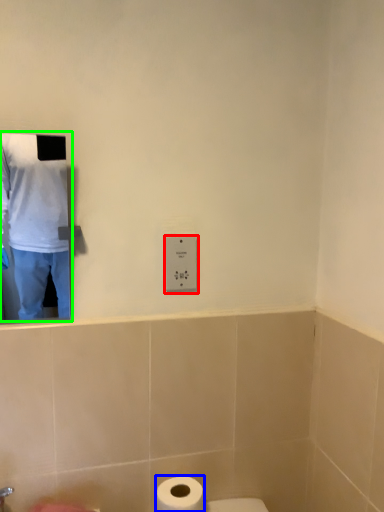
Question: Which is farther away from electric outlet (highlighted by a red box)? toilet paper (highlighted by a blue box) or man (highlighted by a green box)?

Choices:
 (A) toilet paper
 (B) man

Answer: (B)